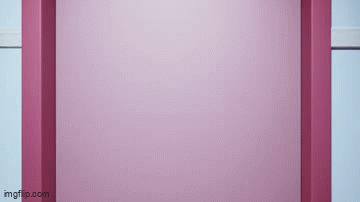
You are a GUI agent. You are given a task and a screenshot of the screen. Output one action in this format:
    pyautogui.click(x=<x>, y=<y>)
    Task: Click on the hinge
    
    Given the screenshot: What is the action you would take?
    (x=55, y=104)